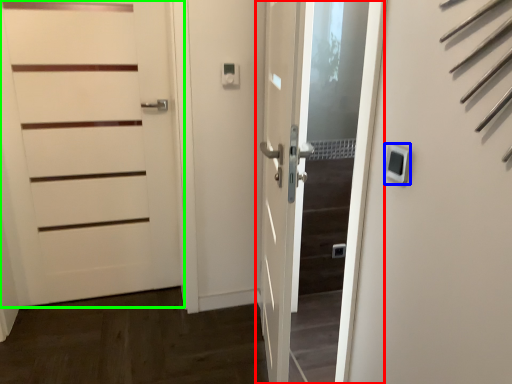
Question: Based on their relative distances, which object is farther from door (highlighted by a red box)? Choose from thermostat (highlighted by a blue box) and door (highlighted by a green box).

Choices:
 (A) thermostat
 (B) door

Answer: (B)